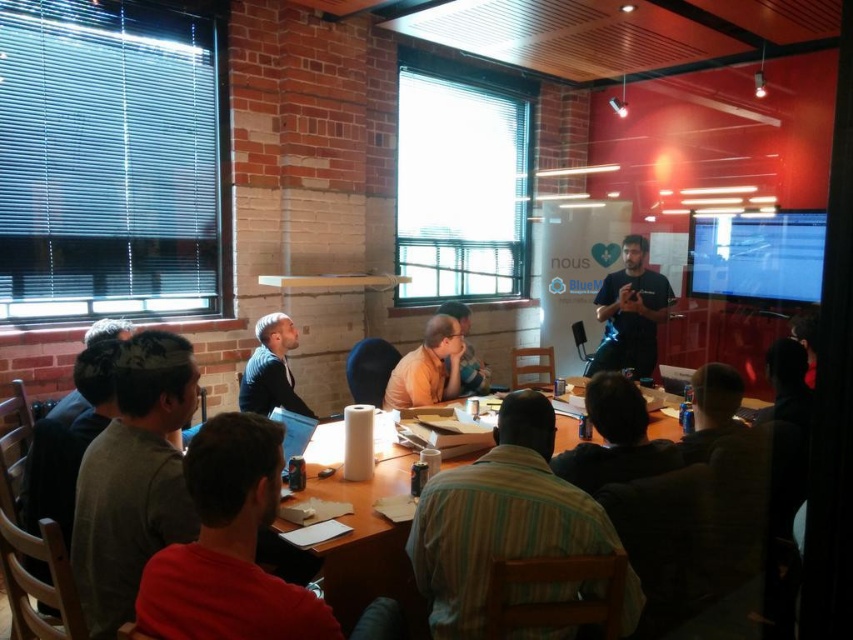
Who is more forward, (x=138, y=477) or (x=466, y=358)?

Point (x=138, y=477)

Is gray fabric shirt at left shorter than pink fabric shirt at center?

No.

Where is `gray fabric shirt at left`? gray fabric shirt at left is located at coordinates (132, 480).

You are a GUI agent. You are given a task and a screenshot of the screen. Output one action in this format:
    pyautogui.click(x=<x>, y=<y>)
    Task: Click on the gray fabric shirt at left
    
    Given the screenshot: What is the action you would take?
    pyautogui.click(x=132, y=480)

Can you confirm if wooden table at center is wider than dark gray shirt at center?

Indeed, wooden table at center has a greater width compared to dark gray shirt at center.

How much distance is there between wooden table at center and dark gray shirt at center?

They are 9.22 inches apart.

Is point (454, 499) positioned before point (630, 429)?

Yes, point (454, 499) is closer to viewer.

This screenshot has height=640, width=853. In order to click on wooden table at center in this screenshot , I will do `click(695, 538)`.

Who is positioned more to the right, striped cotton shirt at center or matte black shirt at lower right?

matte black shirt at lower right is more to the right.

Between point (437, 589) and point (717, 429), which one is positioned behind?

Point (717, 429)

Locate an element on the screen. The image size is (853, 640). striped cotton shirt at center is located at coordinates (498, 516).